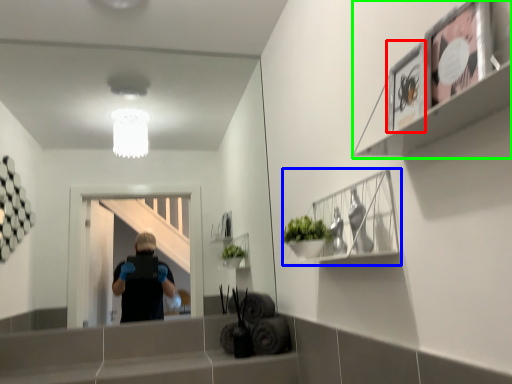
Question: Estimate the real-world distances between objects in this image. Which object is farther from picture frame (highlighted by a red box), cabinet (highlighted by a blue box) or shelf (highlighted by a green box)?

Choices:
 (A) cabinet
 (B) shelf

Answer: (A)